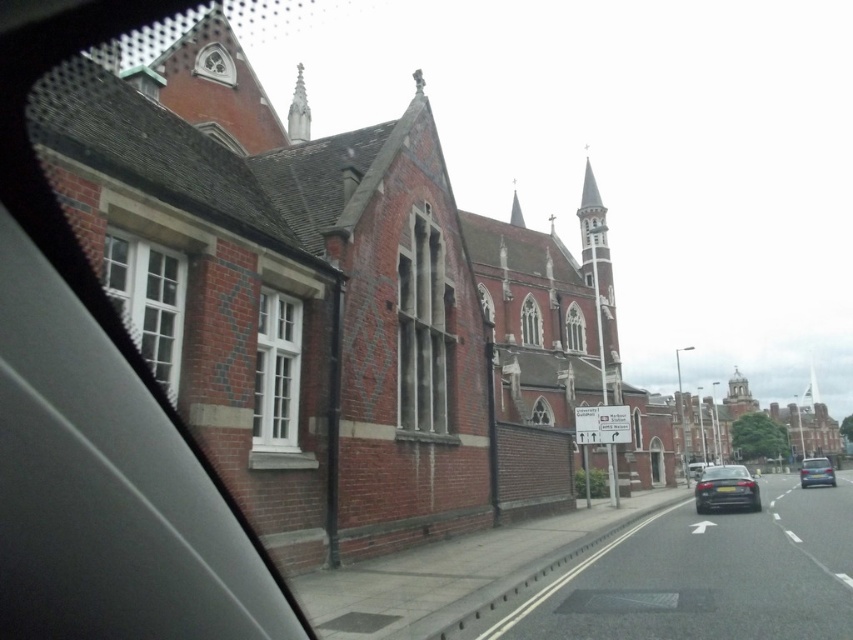
Question: Is red brick church at center positioned in front of matte glass window at center?

Choices:
 (A) yes
 (B) no

Answer: (A)

Question: Is white textured glass at left to the left of white wood window at center from the viewer's perspective?

Choices:
 (A) no
 (B) yes

Answer: (B)

Question: Which object appears closest to the camera in this image?

Choices:
 (A) shiny black sedan at center-right
 (B) clear glass window at center
 (C) metallic silver car at center-right

Answer: (A)

Question: Which point is farther to the camera?

Choices:
 (A) white plastic sign at center
 (B) clear glass window at center

Answer: (B)

Question: Which point is closer to the camera?

Choices:
 (A) (593, 433)
 (B) (755, 484)

Answer: (B)

Question: Is red brick church at center positioned before clear glass window at center?

Choices:
 (A) no
 (B) yes

Answer: (B)